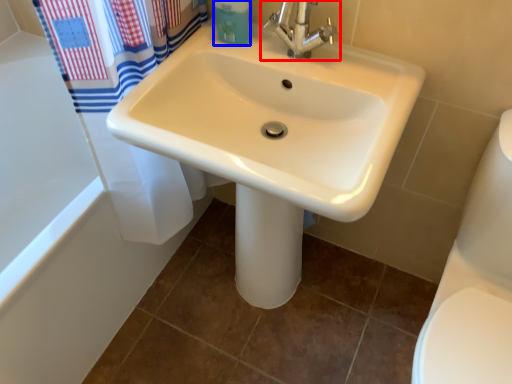
Question: Which object is closer to the camera taking this photo, tap (highlighted by a red box) or toiletry (highlighted by a blue box)?

Choices:
 (A) tap
 (B) toiletry

Answer: (A)